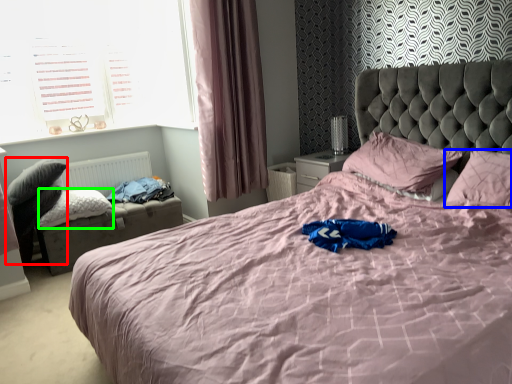
Question: Which object is the closest to the swivel chair (highlighted by a red box)? Choose among these: pillow (highlighted by a blue box) or pillow (highlighted by a green box).

Choices:
 (A) pillow
 (B) pillow

Answer: (B)